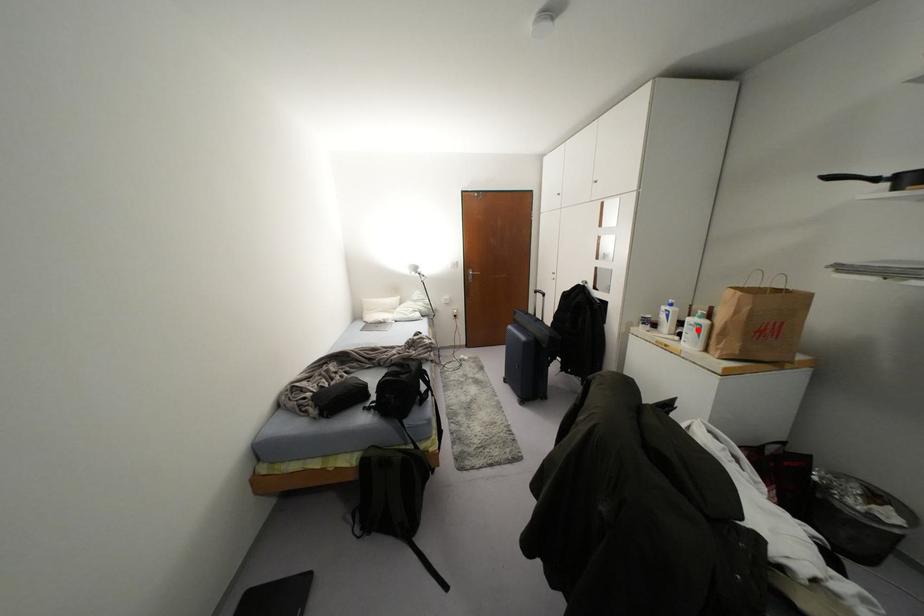
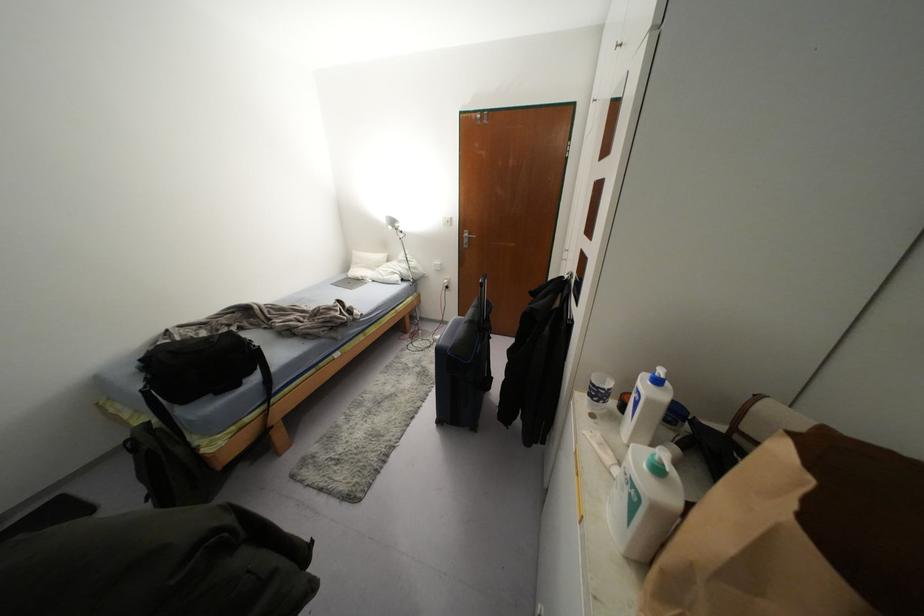
The point at the highlighted location is marked in the first image. Where is the corresponding point in the second image?

(633, 505)